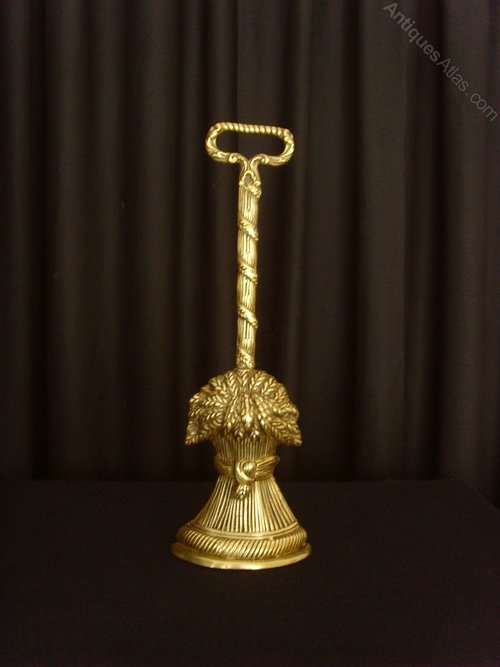
Locate an element on the screen. This screenshot has height=667, width=500. handle is located at coordinates (243, 253).